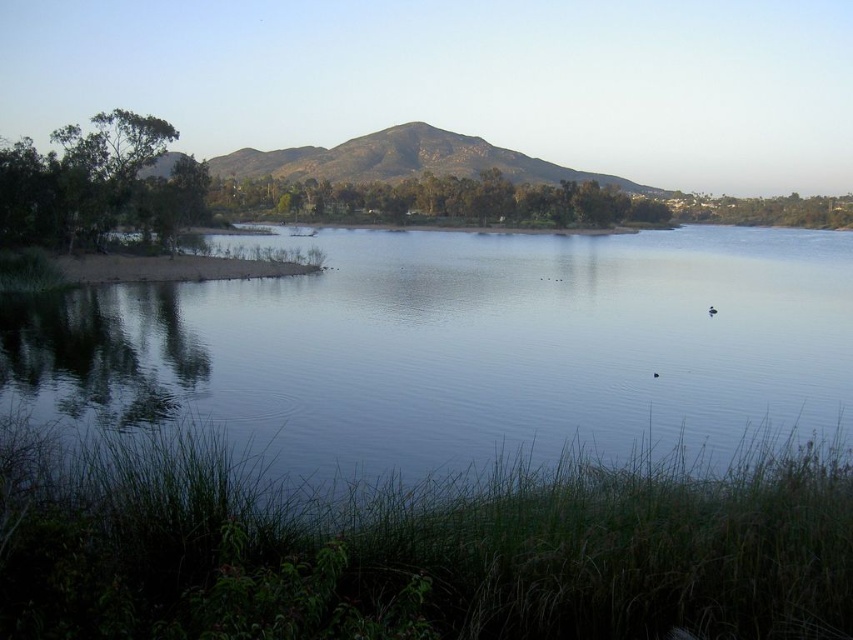
Measure the distance between point [596,435] and camera.

Point [596,435] is 60.83 feet away from camera.

Is clear water at center further to camera compared to brown/dry soil mountain at center?

No, it is in front of brown/dry soil mountain at center.

Where is `clear water at center`? The height and width of the screenshot is (640, 853). clear water at center is located at coordinates (463, 349).